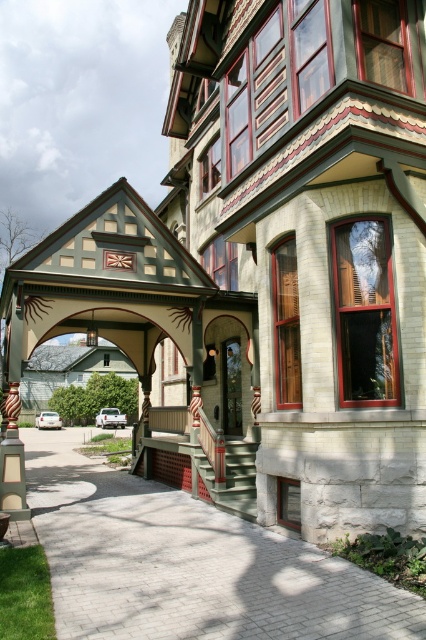
In the scene shown: Is gray brick driveway at lower left positioned before green painted wood porch at lower center?

Yes, it is.

Can you confirm if gray brick driveway at lower left is thinner than green painted wood porch at lower center?

In fact, gray brick driveway at lower left might be wider than green painted wood porch at lower center.

Who is more distant from viewer, (406, 595) or (207, 438)?

The point (207, 438) is more distant.

Locate an element on the screen. gray brick driveway at lower left is located at coordinates (190, 564).